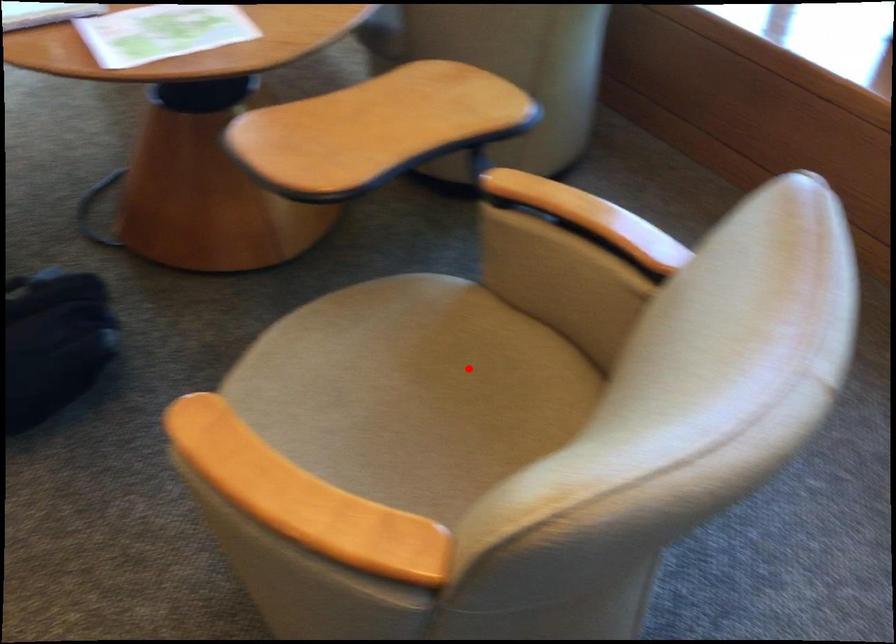
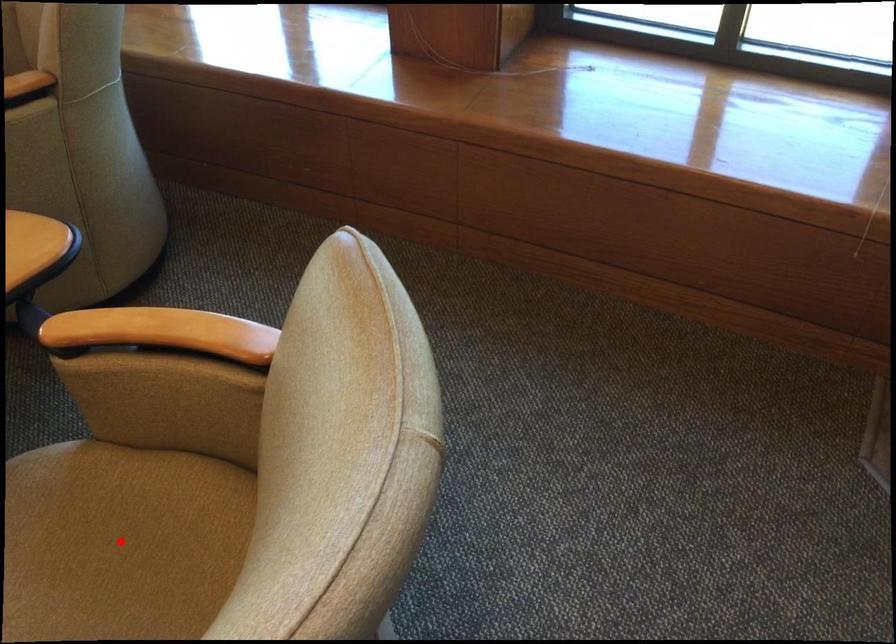
I am providing you with two images of the same scene from different viewpoints. A red point is marked on the first image and another point is marked on the second image. Are the points marked in image1 and image2 representing the same 3D position?

Yes